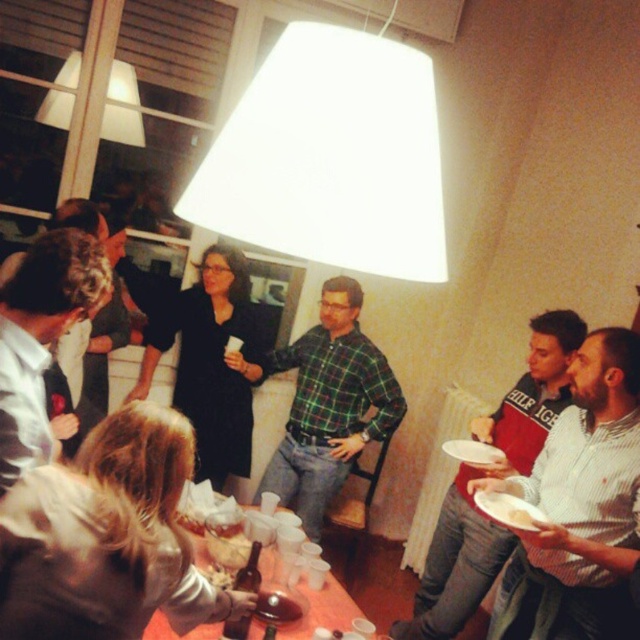
From the picture: Is the position of white matte lampshade at upper center more distant than that of white striped shirt at lower right?

No, it is not.

Does point (195, 186) come farther from viewer compared to point (541, 593)?

No, it is not.

Where is `white matte lampshade at upper center`? The width and height of the screenshot is (640, 640). white matte lampshade at upper center is located at coordinates (332, 156).

Is white striped shirt at lower right behind striped cotton shirt at lower right?

No, it is not.

Is white striped shirt at lower right positioned before striped cotton shirt at lower right?

Yes, white striped shirt at lower right is closer to the viewer.

This screenshot has height=640, width=640. Describe the element at coordinates (579, 502) in the screenshot. I see `white striped shirt at lower right` at that location.

Locate an element on the screen. This screenshot has width=640, height=640. white striped shirt at lower right is located at coordinates (579, 502).

Who is positioned more to the left, striped cotton shirt at lower right or white paper plate at lower right?

Positioned to the left is white paper plate at lower right.

Measure the distance between point (442,579) and camera.

Point (442,579) and camera are 3.00 meters apart.

The height and width of the screenshot is (640, 640). What are the coordinates of `striped cotton shirt at lower right` in the screenshot? It's located at (x=456, y=564).